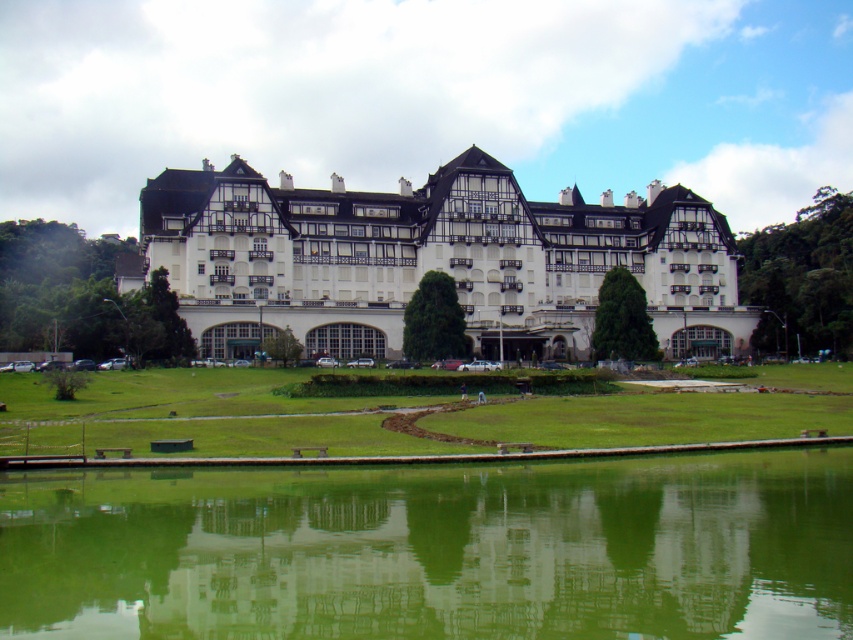
Question: Does green reflective water at center have a smaller size compared to white textured building at center?

Choices:
 (A) yes
 (B) no

Answer: (A)

Question: Which object appears farthest from the camera in this image?

Choices:
 (A) white textured building at center
 (B) green reflective water at center

Answer: (A)

Question: Is green reflective water at center above white textured building at center?

Choices:
 (A) no
 (B) yes

Answer: (A)

Question: Which point is closer to the camera?

Choices:
 (A) (595, 209)
 (B) (195, 502)

Answer: (B)

Question: Is green reflective water at center smaller than white textured building at center?

Choices:
 (A) yes
 (B) no

Answer: (A)